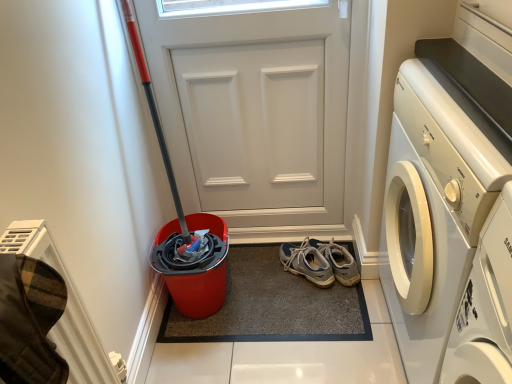
Identify the location of free location to the left of light blue suede sneakers at center. (264, 278).